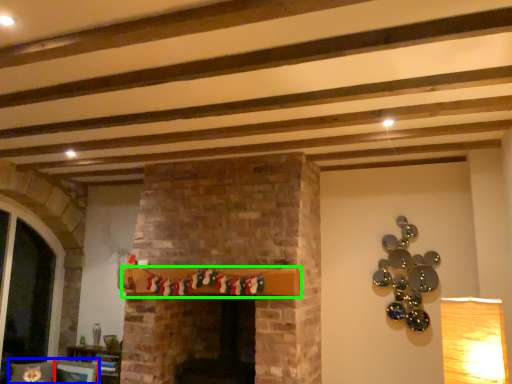
Question: Estimate the real-world distances between objects in this image. Which object is farther from picture frame (highlighted by a red box), chair (highlighted by a blue box) or shelf (highlighted by a green box)?

Choices:
 (A) chair
 (B) shelf

Answer: (B)